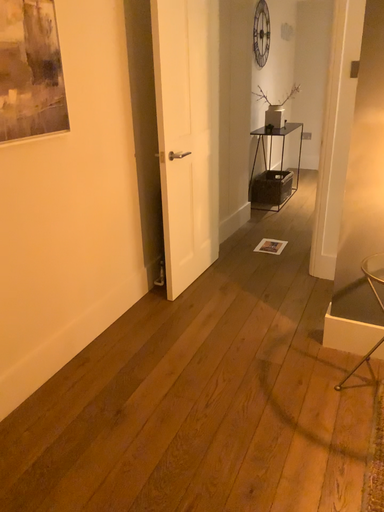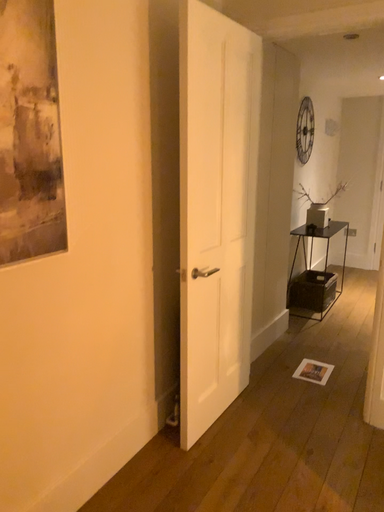
Question: How did the camera likely rotate when shooting the video?

Choices:
 (A) rotated upward
 (B) rotated downward

Answer: (A)